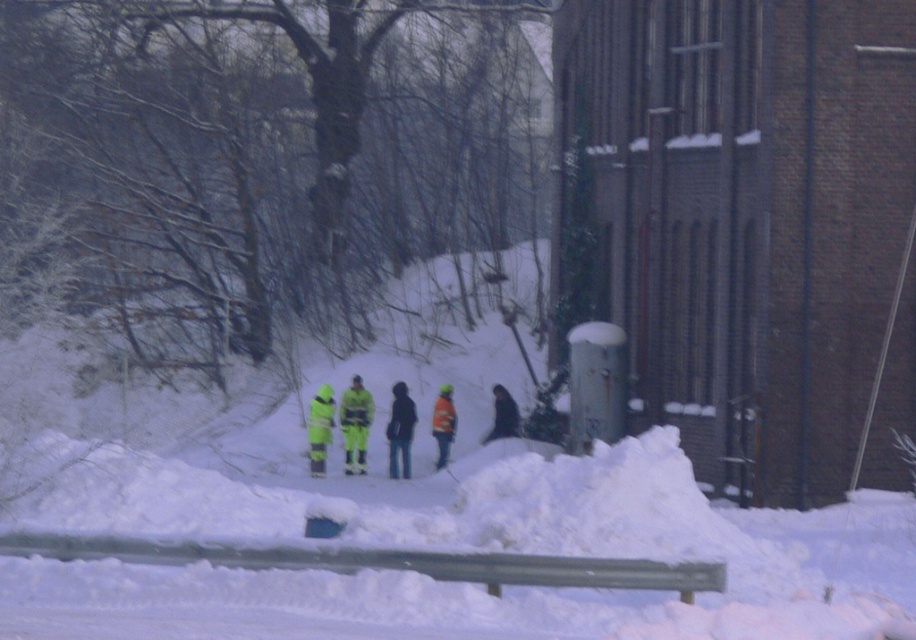
Question: Which point is farther to the camera?

Choices:
 (A) (393, 417)
 (B) (311, 465)
 (C) (442, 428)

Answer: (C)

Question: Observing the image, what is the correct spatial positioning of high-visibility reflective jacket at center in reference to dark matte jacket at center?

Choices:
 (A) below
 (B) above

Answer: (A)

Question: Does dark blue jeans at center have a greater width compared to high-visibility reflective jacket at center?

Choices:
 (A) no
 (B) yes

Answer: (B)

Question: Based on their relative distances, which object is farther from the dark matte jacket at center?

Choices:
 (A) neon yellow reflective jacket at center
 (B) orange reflective jacket at center

Answer: (A)

Question: Is dark blue jeans at center bigger than high-visibility reflective jacket at center?

Choices:
 (A) no
 (B) yes

Answer: (B)

Question: Which point is closer to the camera?

Choices:
 (A) (393, 413)
 (B) (347, 465)
 (C) (324, 452)
 (D) (498, 404)

Answer: (B)